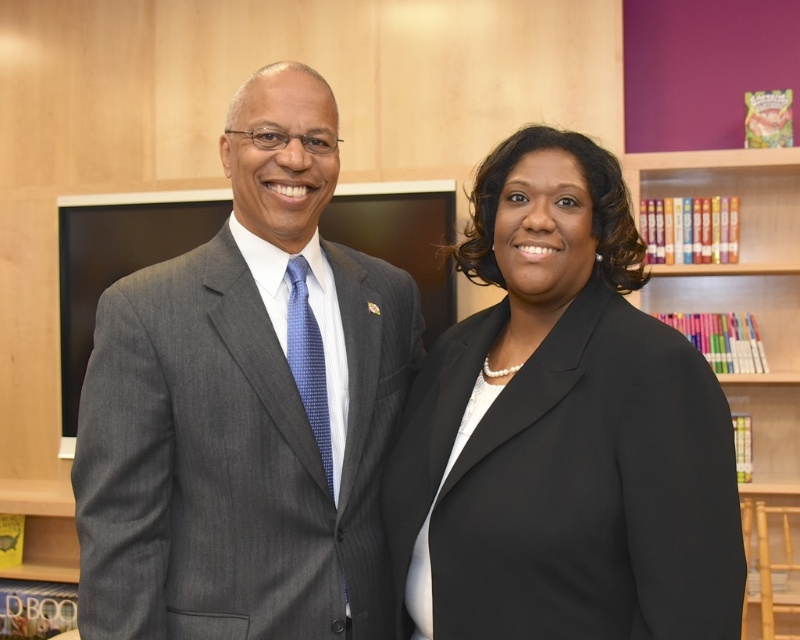
Question: Observing the image, what is the correct spatial positioning of black satin blazer at center in reference to multicolored paperbacks at upper right?

Choices:
 (A) above
 (B) below

Answer: (A)

Question: Which object appears farthest from the camera in this image?

Choices:
 (A) multicolored paperbacks at upper right
 (B) matte gray suit at left
 (C) black satin blazer at center

Answer: (A)

Question: Which point is farther to the camera?

Choices:
 (A) (516, 228)
 (B) (277, 358)

Answer: (B)

Question: Does matte gray suit at left come in front of black satin blazer at center?

Choices:
 (A) yes
 (B) no

Answer: (B)

Question: Considering the real-world distances, which object is closest to the multicolored paperbacks at upper right?

Choices:
 (A) matte gray suit at left
 (B) black satin blazer at center

Answer: (B)

Question: From the image, what is the correct spatial relationship of matte gray suit at left in relation to multicolored paperbacks at upper right?

Choices:
 (A) right
 (B) left

Answer: (B)